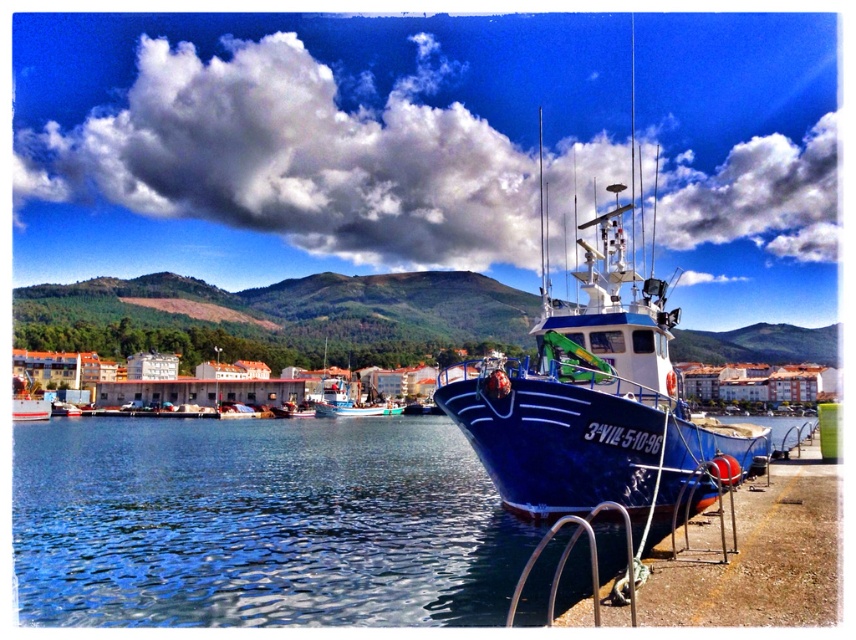
Question: Can you confirm if blue water at lower center is positioned below white glossy boat at lower left?

Choices:
 (A) yes
 (B) no

Answer: (A)

Question: Is blue water at lower center to the left of white glossy boat at lower left from the viewer's perspective?

Choices:
 (A) yes
 (B) no

Answer: (B)

Question: Which point appears farthest from the camera in this image?

Choices:
 (A) (146, 579)
 (B) (34, 388)

Answer: (B)

Question: Among these objects, which one is nearest to the camera?

Choices:
 (A) white glossy boat at lower left
 (B) blue water at lower center

Answer: (B)

Question: Can you confirm if blue water at lower center is positioned above white glossy boat at lower left?

Choices:
 (A) no
 (B) yes

Answer: (A)